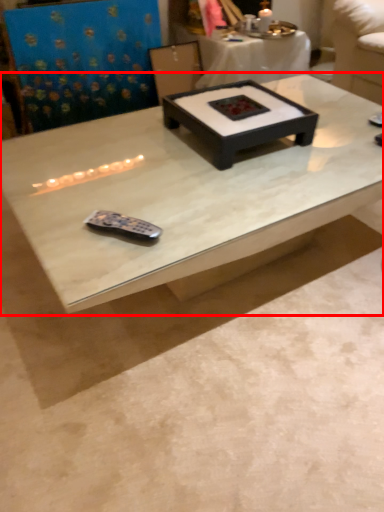
Question: Considering the relative positions of coffee table (annotated by the red box) and coffee table in the image provided, where is coffee table (annotated by the red box) located with respect to the staircase?

Choices:
 (A) right
 (B) left

Answer: (B)